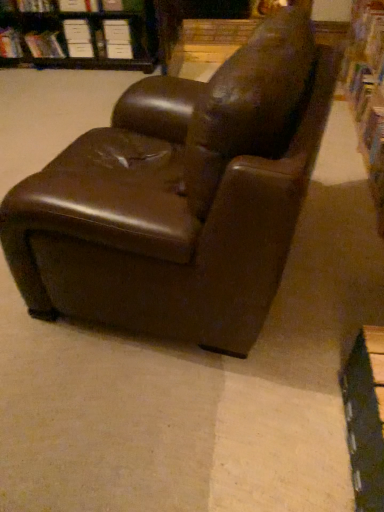
Locate an element on the screen. Image resolution: width=384 pixels, height=512 pixels. blank space situated above hardcover book at upper left, which appears as the 2th book when viewed from the left (from a real-world perspective) is located at coordinates (42, 34).